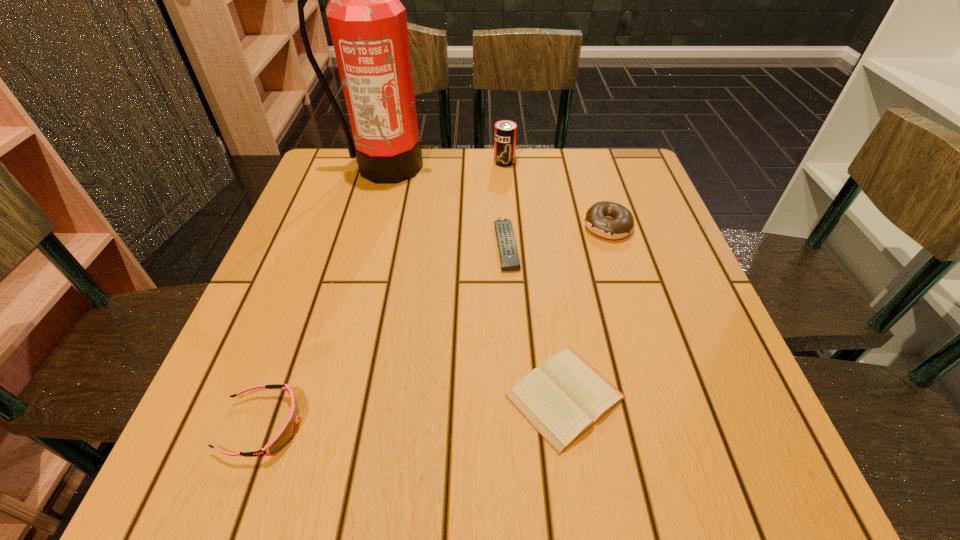
At what (x,y) coordinates should I click in order to perform the action: click on vacant space located 0.090m on the back of the diary. Please return your answer as a coordinate pair (x, y). Looking at the image, I should click on (552, 308).

The image size is (960, 540). Identify the location of free space located on the left of the remote control. (467, 245).

Locate an element on the screen. This screenshot has height=540, width=960. fire extinguisher present at the far edge is located at coordinates (368, 25).

At what (x,y) coordinates should I click in order to perform the action: click on can located in the far edge section of the desktop. Please return your answer as a coordinate pair (x, y). The height and width of the screenshot is (540, 960). Looking at the image, I should click on coord(505,131).

You are a GUI agent. You are given a task and a screenshot of the screen. Output one action in this format:
    pyautogui.click(x=<x>, y=<y>)
    Task: Click on the goggles that is at the near edge
    
    Given the screenshot: What is the action you would take?
    pyautogui.click(x=287, y=432)

Identify the location of diary that is positioned at the near edge. (563, 399).

Locate an element on the screen. Image resolution: width=960 pixels, height=540 pixels. fire extinguisher at the left edge is located at coordinates (368, 25).

Where is `goggles located at the left edge`? This screenshot has width=960, height=540. goggles located at the left edge is located at coordinates (287, 432).

Where is `object located at the right edge`? This screenshot has width=960, height=540. object located at the right edge is located at coordinates (610, 220).

Image resolution: width=960 pixels, height=540 pixels. Find the location of `object that is at the far left corner`. object that is at the far left corner is located at coordinates (368, 25).